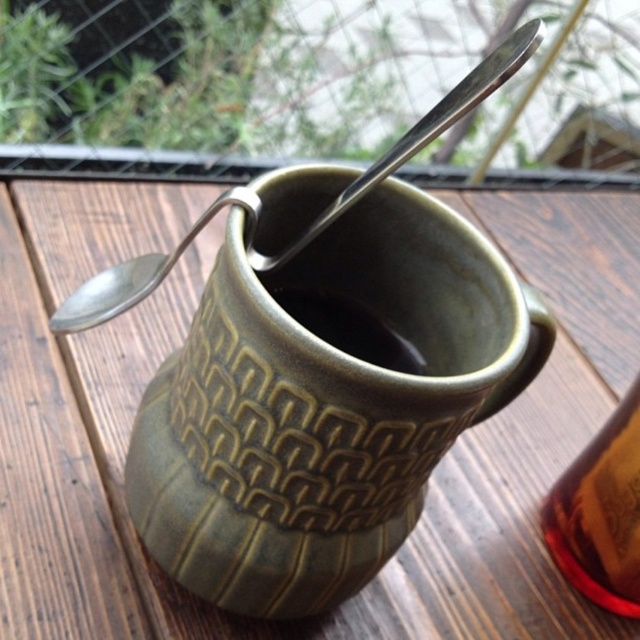
Question: Which point is closer to the camera?

Choices:
 (A) (620, 483)
 (B) (417, 380)

Answer: (B)

Question: Among these points, which one is nearest to the camera?

Choices:
 (A) (596, 570)
 (B) (246, 225)
 (C) (524, 321)

Answer: (B)

Question: Is green textured mug at center below satin silver spoon at left?

Choices:
 (A) no
 (B) yes

Answer: (B)

Question: Is translucent amber liquid at upper right bigger than satin silver spoon at left?

Choices:
 (A) yes
 (B) no

Answer: (B)

Question: Which of the following is the closest to the observer?

Choices:
 (A) green textured mug at center
 (B) satin silver spoon at left
 (C) translucent amber liquid at upper right

Answer: (A)

Question: Considering the relative positions of green textured mug at center and translucent amber liquid at upper right in the image provided, where is green textured mug at center located with respect to translucent amber liquid at upper right?

Choices:
 (A) left
 (B) right

Answer: (A)